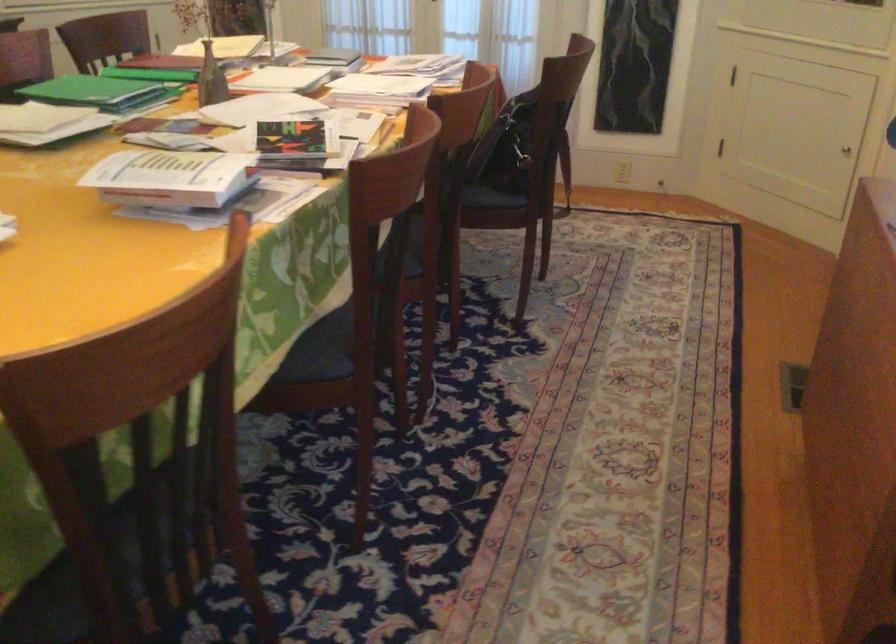
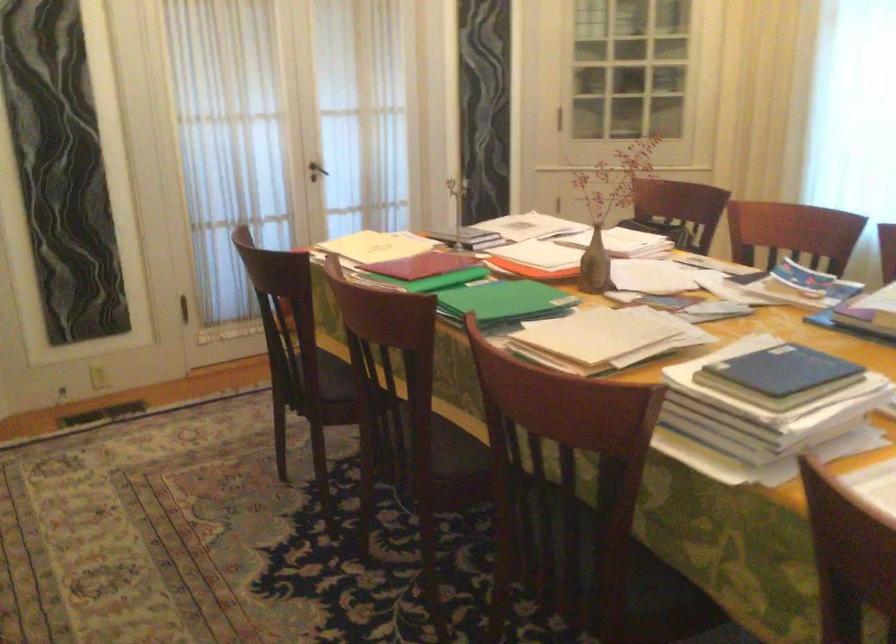
Question: I am providing you with two images of the same scene from different viewpoints. Please identify which objects are invisible in image2.

Choices:
 (A) yellow folder
 (B) dark door handle
 (C) tripod head handle
 (D) chair sitting surface

Answer: (D)